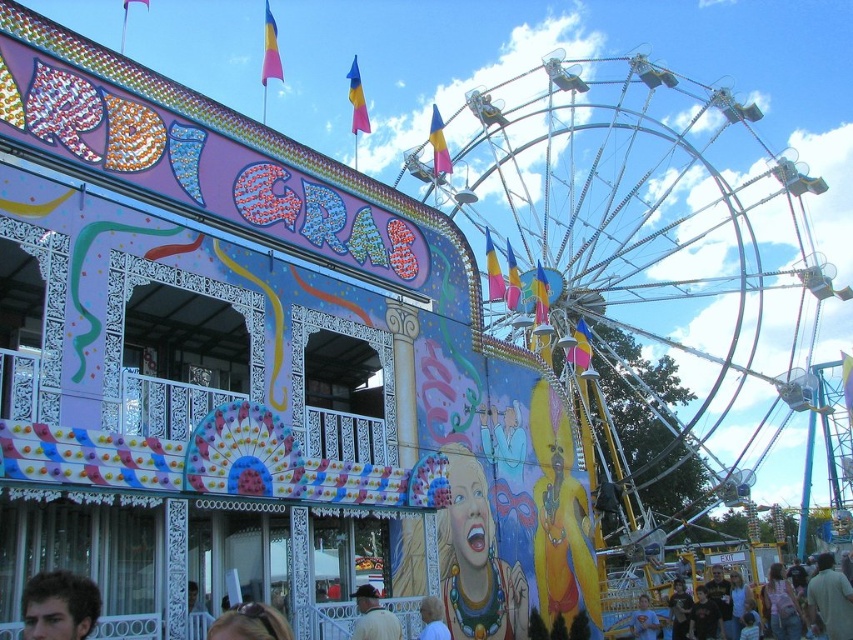
Question: Which is nearer to the brown hair at lower center?

Choices:
 (A) smooth yellow dress at center
 (B) smooth beige shirt at lower center
 (C) dark brown hair at lower left
 (D) metallic silver ferris wheel at upper right

Answer: (C)

Question: Is metallic silver ferris wheel at upper right thinner than brown hair at lower center?

Choices:
 (A) no
 (B) yes

Answer: (A)

Question: In this image, where is smooth yellow dress at center located relative to brown leather jacket at lower center?

Choices:
 (A) above
 (B) below

Answer: (A)

Question: Among these points, which one is nearest to the camera?

Choices:
 (A) (379, 632)
 (B) (817, 586)
 (C) (645, 193)

Answer: (A)

Question: Estimate the real-world distances between objects in this image. Which object is farther from the smooth yellow dress at center?

Choices:
 (A) brown leather jacket at lower center
 (B) dark brown hair at lower left
 (C) metallic silver ferris wheel at upper right
 (D) light brown hair at center

Answer: (C)

Question: In this image, where is light brown hair at lower right located relative to dark brown hair at lower left?

Choices:
 (A) left
 (B) right

Answer: (B)